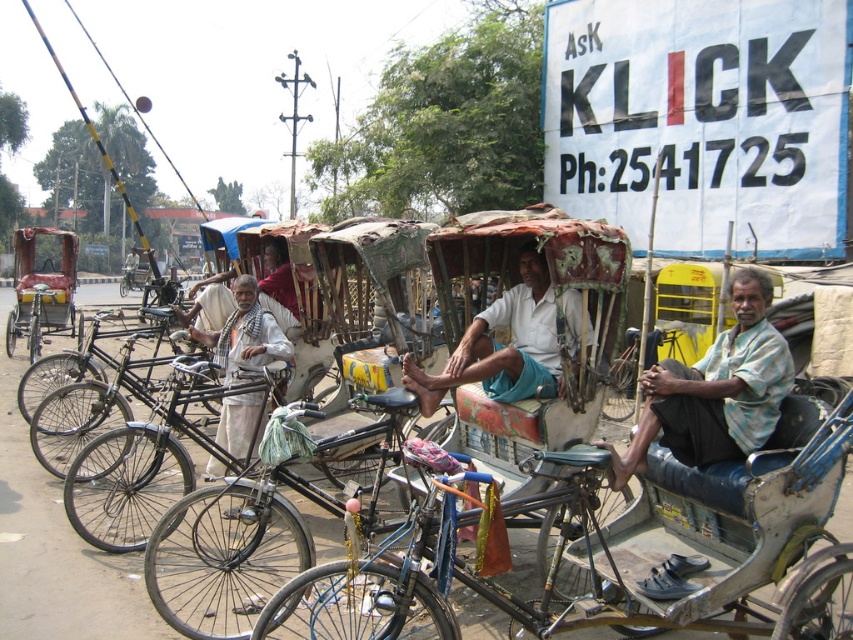
Can you confirm if blue metallic bicycle at center is thinner than shiny metallic bicycle at center?

Indeed, blue metallic bicycle at center has a lesser width compared to shiny metallic bicycle at center.

Is the position of blue metallic bicycle at center more distant than that of shiny metallic bicycle at center?

No, blue metallic bicycle at center is in front of shiny metallic bicycle at center.

The width and height of the screenshot is (853, 640). Identify the location of blue metallic bicycle at center. (424, 570).

Between point (222, 419) and point (25, 301), which one is positioned behind?

The point (25, 301) is behind.

Is white cotton scarf at center closer to the viewer compared to rusty metal rickshaw at left?

Yes, white cotton scarf at center is closer to the viewer.

Between point (206, 472) and point (28, 342), which one is positioned in front?

Point (206, 472)

Locate an element on the screen. white cotton scarf at center is located at coordinates (245, 333).

Does blue metallic bicycle at center have a larger size compared to black matte bicycle at center?

Incorrect, blue metallic bicycle at center is not larger than black matte bicycle at center.

Who is more forward, (547, 452) or (175, 432)?

Positioned in front is point (547, 452).

Between point (440, 515) and point (184, 433), which one is positioned behind?

The point (184, 433) is more distant.

Image resolution: width=853 pixels, height=640 pixels. I want to click on blue metallic bicycle at center, so click(x=424, y=570).